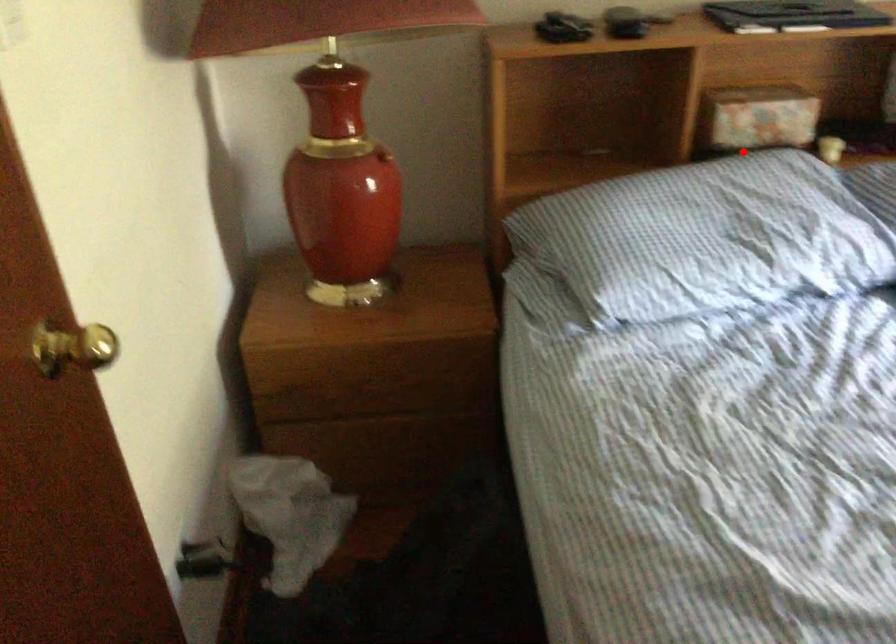
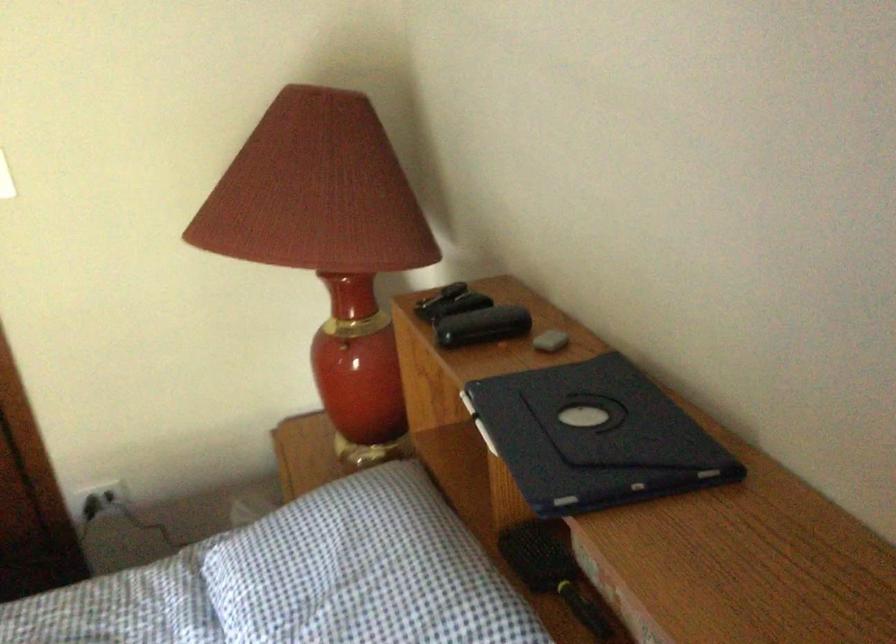
Question: I am providing you with two images of the same scene from different viewpoints. Given a red point in image1, look at the same physical point in image2. Is it:

Choices:
 (A) Closer to the viewpoint
 (B) Farther from the viewpoint

Answer: (A)